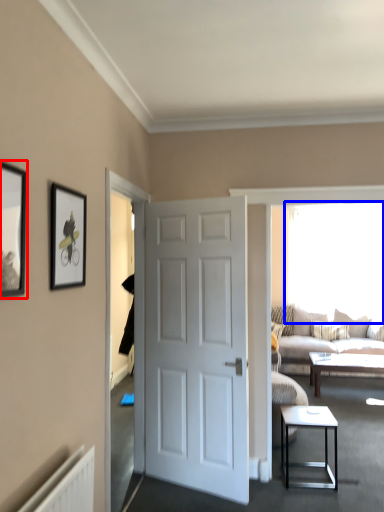
Question: Which object is further to the camera taking this photo, picture frame (highlighted by a red box) or window screen (highlighted by a blue box)?

Choices:
 (A) picture frame
 (B) window screen

Answer: (B)